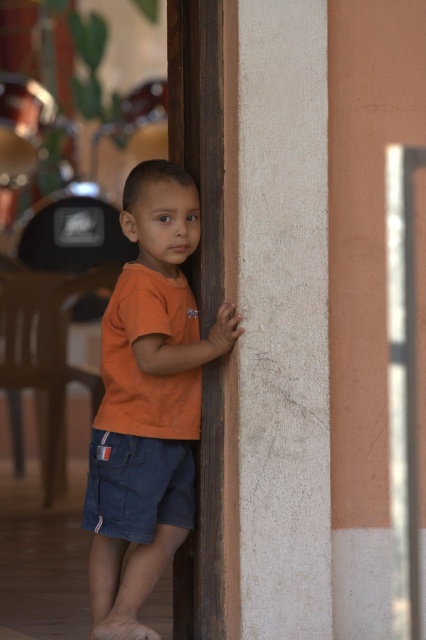
The child is wearing an orange cotton shirt at center and denim shorts at lower left. Which clothing item appears bigger in the image?

The orange cotton shirt at center appears bigger than the denim shorts at lower left in the image.

You are a fashion designer observing a child wearing an orange cotton shirt at center and denim shorts at lower left. Which clothing item is located to the right of the other?

The orange cotton shirt at center is positioned on the right side of denim shorts at lower left.